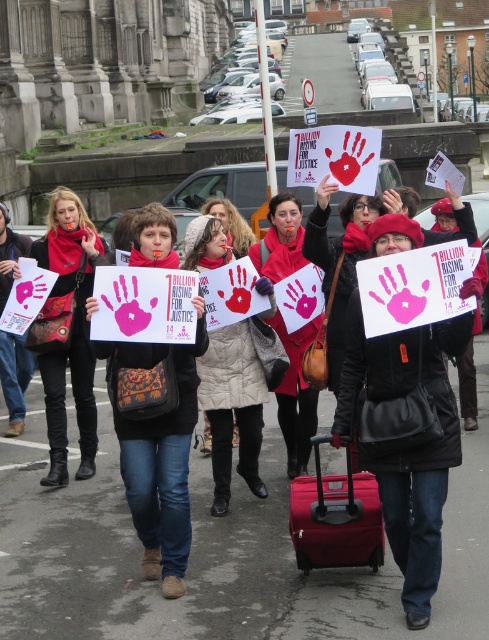
You are a photographer trying to capture a clear shot of the beige quilted coat at center without the matte black scarf at center blocking it. Based on their positions, is this possible?

The matte black scarf at center is above the beige quilted coat at center, so you can capture the coat without the scarf by adjusting the angle to avoid the scarf above it.

You are a photographer trying to capture a photo of the matte red coat at center and the matte gray coat at center. Which coat should you focus on if you want to include both in the frame without cropping the taller one?

You should focus on the matte gray coat at center because it is taller than the matte red coat at center, ensuring it fits in the frame without cropping.

Looking at this image, you are a photographer trying to capture a clear shot of the matte red suitcase at lower center and the matte gray coat at center. Since you want both objects in focus, which one should you adjust your camera lens to prioritize focusing on first?

The matte red suitcase at lower center is closer to the viewer than the matte gray coat at center. To ensure both are in focus, the photographer should focus on the matte red suitcase at lower center first, as it is closer, and use a smaller aperture for a deeper depth of field.